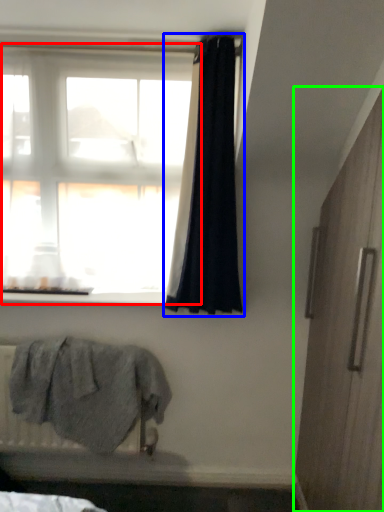
Question: Estimate the real-world distances between objects in this image. Which object is closer to window (highlighted by a red box), curtain (highlighted by a blue box) or screen door (highlighted by a green box)?

Choices:
 (A) curtain
 (B) screen door

Answer: (A)